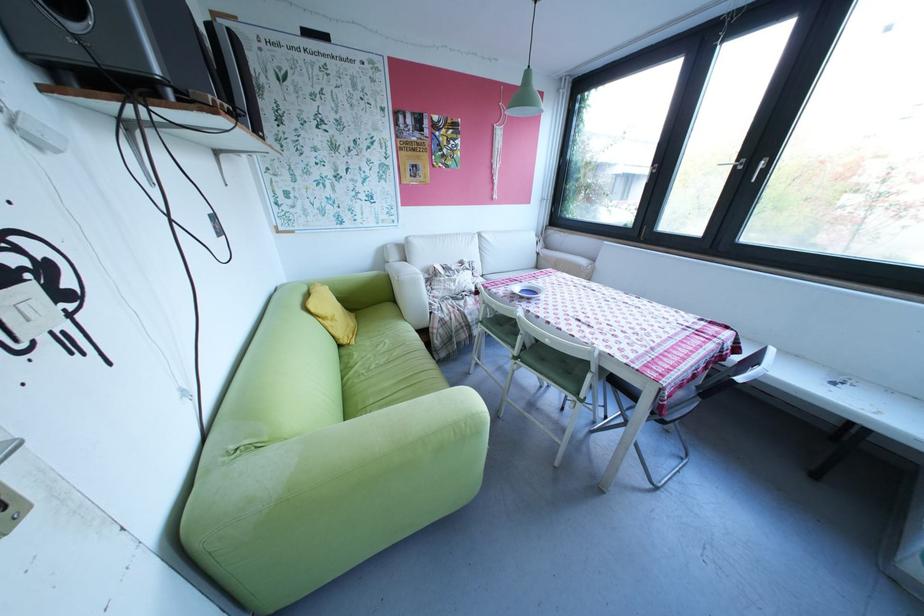
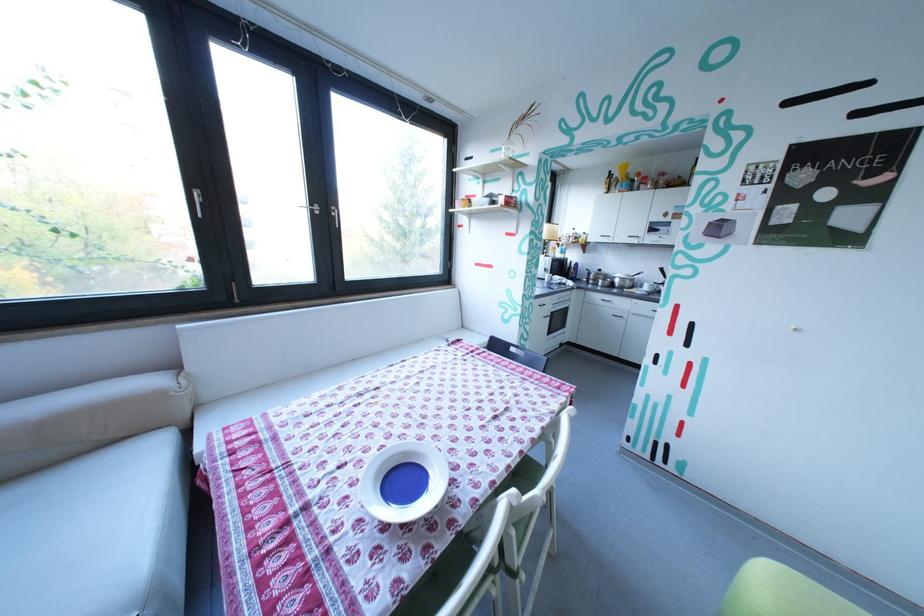
In the second image, find the point that corresponds to point 754,168 in the first image.

(331, 213)